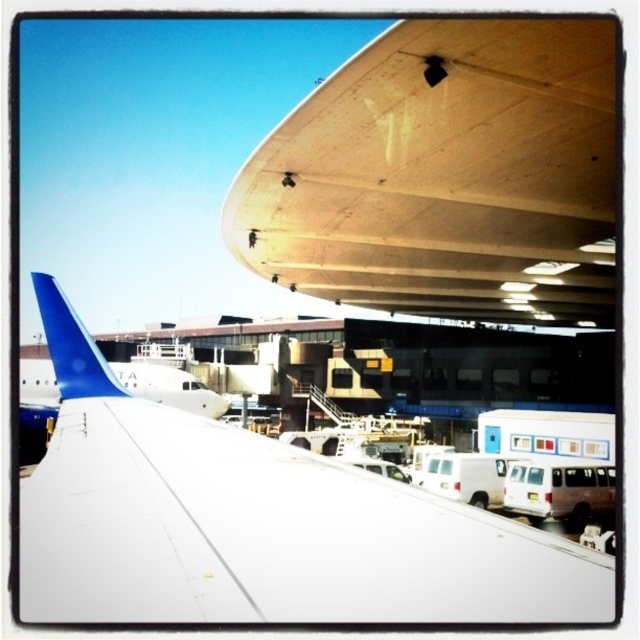
Is wooden airplane wing at upper center to the right of blue matte airplane tail at left from the viewer's perspective?

Indeed, wooden airplane wing at upper center is positioned on the right side of blue matte airplane tail at left.

Which is behind, point (472, 262) or point (99, 378)?

The point (472, 262) is more distant.

Which is behind, point (406, 288) or point (33, 278)?

The point (406, 288) is behind.

The width and height of the screenshot is (640, 640). I want to click on wooden airplane wing at upper center, so [445, 176].

Is the position of wooden airplane wing at upper center more distant than that of white matte wing at upper center?

Yes, it is.

Image resolution: width=640 pixels, height=640 pixels. Describe the element at coordinates (445, 176) in the screenshot. I see `wooden airplane wing at upper center` at that location.

Between point (324, 138) and point (102, 385), which one is positioned in front?

Point (324, 138)

The height and width of the screenshot is (640, 640). I want to click on wooden airplane wing at upper center, so click(x=445, y=176).

The width and height of the screenshot is (640, 640). What do you see at coordinates (257, 525) in the screenshot? I see `white matte wing at upper center` at bounding box center [257, 525].

Who is more forward, (93, 600) or (115, 380)?

Point (93, 600) is more forward.

Who is more distant from viewer, (246, 552) or (77, 326)?

The point (77, 326) is more distant.

Locate an element on the screen. Image resolution: width=640 pixels, height=640 pixels. white matte wing at upper center is located at coordinates (257, 525).